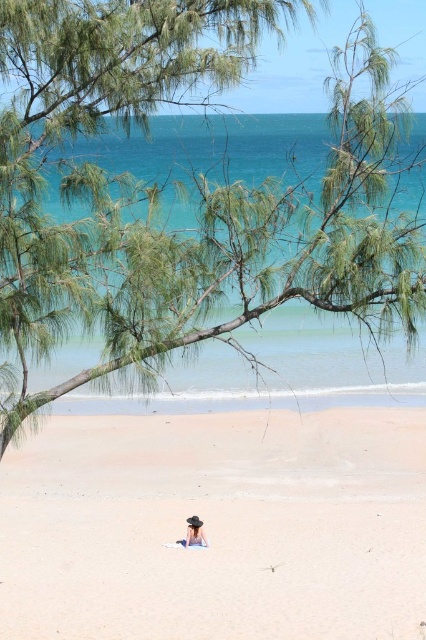
Question: In this image, where is light beige sand at center located relative to matte blue dress at lower center?

Choices:
 (A) left
 (B) right

Answer: (B)

Question: Which object is the farthest from the green leafy branch at upper center?

Choices:
 (A) light beige sand at center
 (B) matte blue dress at lower center

Answer: (B)

Question: Can you confirm if green leafy branch at upper center is thinner than light beige sand at center?

Choices:
 (A) yes
 (B) no

Answer: (B)

Question: Is green leafy branch at upper center positioned in front of matte blue dress at lower center?

Choices:
 (A) yes
 (B) no

Answer: (A)

Question: Which object is farther from the camera taking this photo?

Choices:
 (A) green leafy branch at upper center
 (B) light beige sand at center

Answer: (B)

Question: Which object is the closest to the light beige sand at center?

Choices:
 (A) green leafy branch at upper center
 (B) matte blue dress at lower center

Answer: (B)